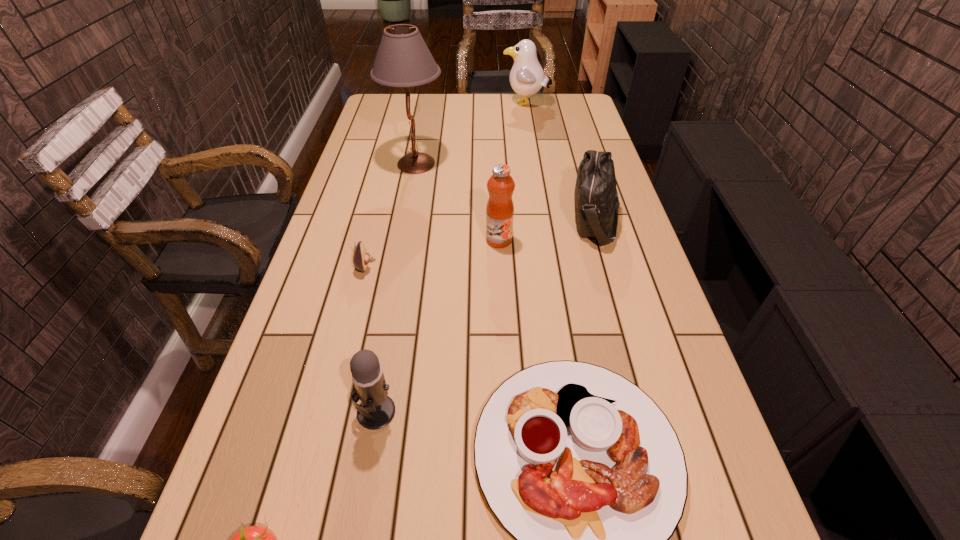
You are a GUI agent. You are given a task and a screenshot of the screen. Output one action in this format:
    pyautogui.click(x=<x>, y=<y>)
    Task: Click on the avocado at the left edge
    Image resolution: width=960 pixels, height=540 pixels.
    Given the screenshot: What is the action you would take?
    pyautogui.click(x=361, y=258)

The width and height of the screenshot is (960, 540). I want to click on gull present at the right edge, so click(x=527, y=77).

In order to click on shoulder bag located at the right edge in this screenshot , I will do 596,199.

This screenshot has height=540, width=960. Identify the location of object that is positioned at the far right corner. (527, 77).

The width and height of the screenshot is (960, 540). I want to click on vacant area at the far edge, so click(x=437, y=112).

I want to click on vacant area at the left edge, so click(x=343, y=197).

Locate an element on the screen. This screenshot has width=960, height=540. vacant space at the far left corner of the desktop is located at coordinates 385,101.

Where is `empty location between the shoulder bag and the gull`? This screenshot has height=540, width=960. empty location between the shoulder bag and the gull is located at coordinates (561, 162).

Image resolution: width=960 pixels, height=540 pixels. Find the location of `free spot between the gull and the microphone`. free spot between the gull and the microphone is located at coordinates (451, 258).

Where is `vacant area that lies between the farthest object and the shoulder bag`? vacant area that lies between the farthest object and the shoulder bag is located at coordinates (561, 162).